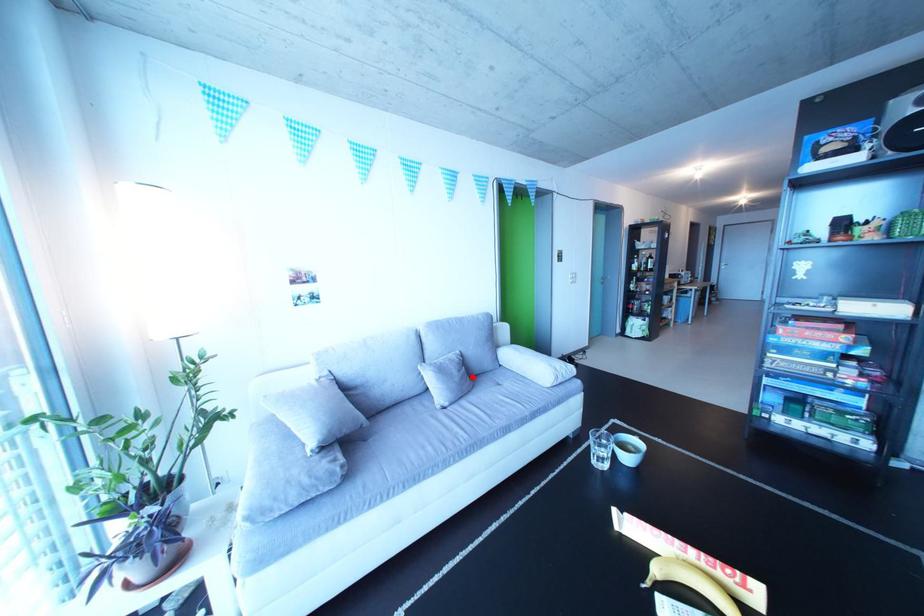
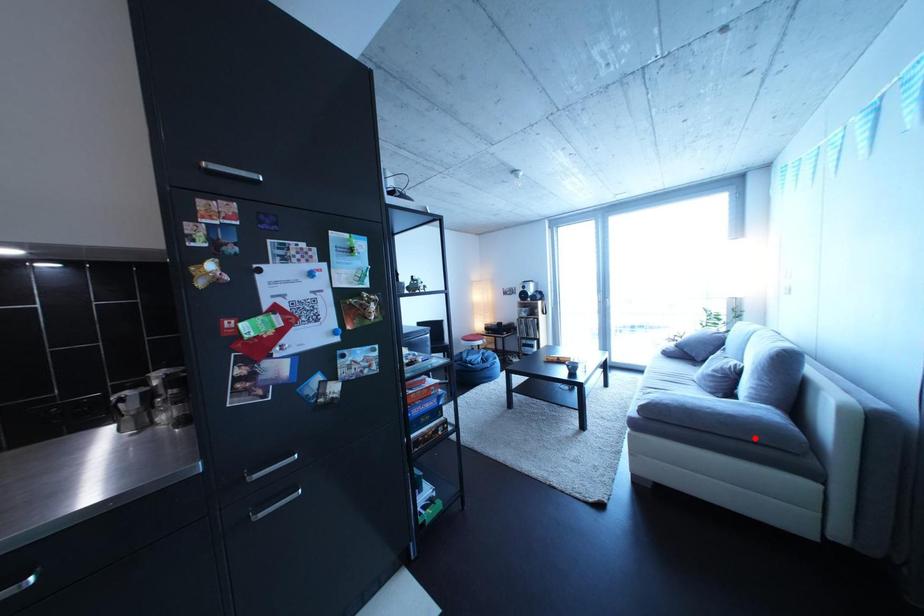
I am providing you with two images of the same scene from different viewpoints. A red point is marked on the first image and another point is marked on the second image. Does the point marked in image1 correspond to the same location as the one in image2?

No